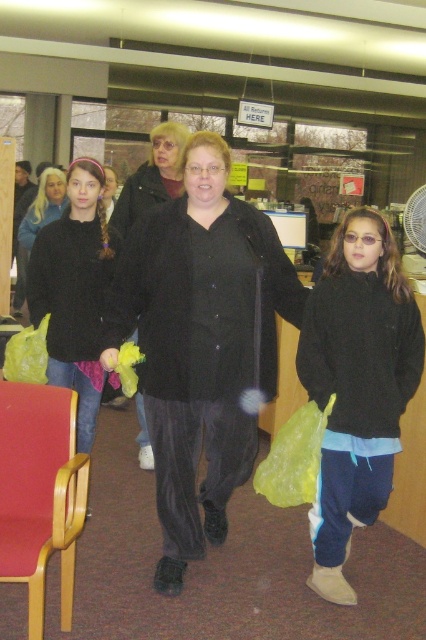
Question: Which is farther from the wooden armchair at lower left?

Choices:
 (A) matte black jacket at center
 (B) matte black coat at center
 (C) black fuzzy sweater at center

Answer: (A)

Question: Does wooden armchair at lower left have a greater width compared to matte black jacket at left?

Choices:
 (A) yes
 (B) no

Answer: (B)

Question: Does matte black coat at center appear on the left side of matte black jacket at center?

Choices:
 (A) no
 (B) yes

Answer: (A)

Question: Which of these objects is positioned closest to the black fuzzy sweater at center?

Choices:
 (A) matte black jacket at center
 (B) black velvet coat at center

Answer: (B)

Question: Based on their relative distances, which object is nearer to the black velvet coat at center?

Choices:
 (A) wooden armchair at lower left
 (B) matte black jacket at center
 (C) black fuzzy sweater at center

Answer: (C)

Question: Can you confirm if black velvet coat at center is thinner than black fuzzy sweater at center?

Choices:
 (A) yes
 (B) no

Answer: (B)